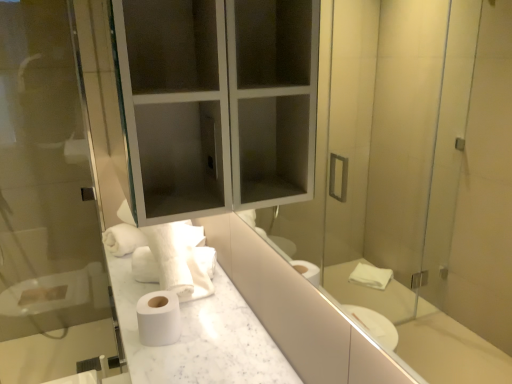
Question: Is white marble countertop at center far away from transparent glass screen door at left?

Choices:
 (A) yes
 (B) no

Answer: (A)

Question: Is white marble countertop at center directly adjacent to transparent glass screen door at left?

Choices:
 (A) yes
 (B) no

Answer: (B)

Question: Considering the relative sizes of white marble countertop at center and transparent glass screen door at left in the image provided, is white marble countertop at center bigger than transparent glass screen door at left?

Choices:
 (A) yes
 (B) no

Answer: (B)

Question: Does white marble countertop at center have a greater width compared to transparent glass screen door at left?

Choices:
 (A) no
 (B) yes

Answer: (B)

Question: From the image's perspective, is white marble countertop at center over transparent glass screen door at left?

Choices:
 (A) no
 (B) yes

Answer: (A)

Question: Is white marble countertop at center wider or thinner than transparent glass screen door at left?

Choices:
 (A) thin
 (B) wide

Answer: (B)

Question: Is white marble countertop at center spatially inside transparent glass screen door at left, or outside of it?

Choices:
 (A) inside
 (B) outside

Answer: (B)

Question: Is white marble countertop at center in front of or behind transparent glass screen door at left in the image?

Choices:
 (A) behind
 (B) front

Answer: (B)

Question: From a real-world perspective, is white marble countertop at center positioned above or below transparent glass screen door at left?

Choices:
 (A) above
 (B) below

Answer: (B)

Question: Based on their sizes in the image, would you say matte glass medicine cabinet at upper center is bigger or smaller than white matte toilet paper at center?

Choices:
 (A) small
 (B) big

Answer: (B)

Question: From the image's perspective, relative to white matte toilet paper at center, is matte glass medicine cabinet at upper center above or below?

Choices:
 (A) below
 (B) above

Answer: (B)

Question: In the image, is matte glass medicine cabinet at upper center positioned in front of or behind white matte toilet paper at center?

Choices:
 (A) behind
 (B) front

Answer: (B)

Question: From a real-world perspective, is matte glass medicine cabinet at upper center above or below white matte toilet paper at center?

Choices:
 (A) below
 (B) above

Answer: (B)

Question: From a real-world perspective, is matte glass medicine cabinet at upper center positioned above or below transparent glass screen door at left?

Choices:
 (A) below
 (B) above

Answer: (B)

Question: Relative to transparent glass screen door at left, is matte glass medicine cabinet at upper center in front or behind?

Choices:
 (A) front
 (B) behind

Answer: (A)